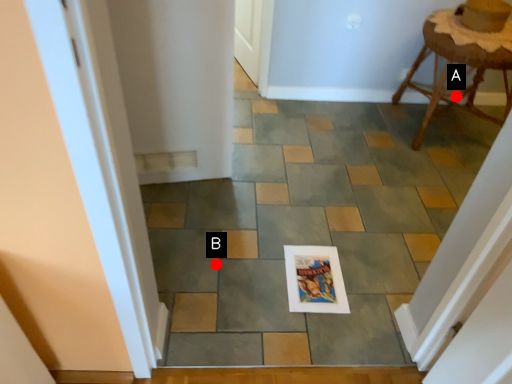
Question: Two points are circled on the image, labeled by A and B beside each circle. Which point is further to the camera?

Choices:
 (A) A is further
 (B) B is further

Answer: (A)